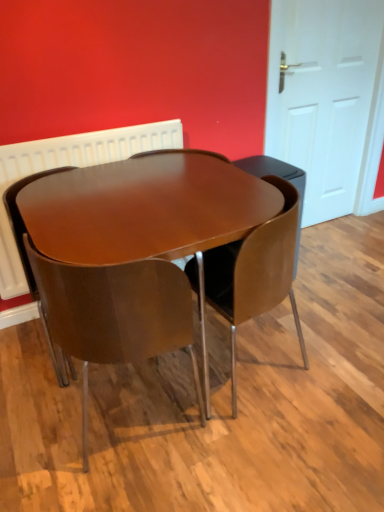
Question: Does white glossy door at right appear on the left side of matte brown chair at center, acting as the 2th chair starting from the left?

Choices:
 (A) no
 (B) yes

Answer: (A)

Question: Is the position of white glossy door at right more distant than that of matte brown chair at center, acting as the 2th chair starting from the left?

Choices:
 (A) no
 (B) yes

Answer: (B)

Question: From a real-world perspective, is white glossy door at right over matte brown chair at center, acting as the 2th chair starting from the left?

Choices:
 (A) yes
 (B) no

Answer: (A)

Question: Is white glossy door at right smaller than matte brown chair at center, acting as the 2th chair starting from the left?

Choices:
 (A) yes
 (B) no

Answer: (A)

Question: Is matte brown chair at center, the second chair when ordered from right to left, at the back of white glossy door at right?

Choices:
 (A) no
 (B) yes

Answer: (A)

Question: Is matte brown chair at center, acting as the 2th chair starting from the left, located within white glossy door at right?

Choices:
 (A) no
 (B) yes

Answer: (A)

Question: Does white glossy door at right have a smaller size compared to glossy wood chair at center, the first chair in the left-to-right sequence?

Choices:
 (A) yes
 (B) no

Answer: (A)

Question: Considering the relative sizes of white glossy door at right and glossy wood chair at center, the first chair in the left-to-right sequence, in the image provided, is white glossy door at right wider than glossy wood chair at center, the first chair in the left-to-right sequence,?

Choices:
 (A) yes
 (B) no

Answer: (B)

Question: Can you confirm if white glossy door at right is taller than glossy wood chair at center, which is counted as the third chair, starting from the right?

Choices:
 (A) yes
 (B) no

Answer: (A)

Question: Is there a large distance between white glossy door at right and glossy wood chair at center, the first chair in the left-to-right sequence?

Choices:
 (A) no
 (B) yes

Answer: (B)

Question: From a real-world perspective, is white glossy door at right physically above glossy wood chair at center, which is counted as the third chair, starting from the right?

Choices:
 (A) no
 (B) yes

Answer: (B)

Question: Is white glossy door at right thinner than glossy wood chair at center, which is counted as the third chair, starting from the right?

Choices:
 (A) yes
 (B) no

Answer: (A)

Question: From a real-world perspective, is glossy wood table at center positioned over white glossy door at right based on gravity?

Choices:
 (A) yes
 (B) no

Answer: (B)